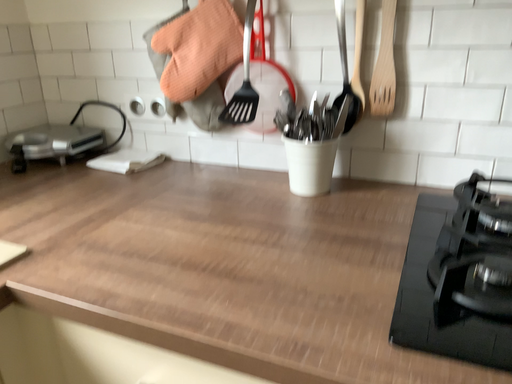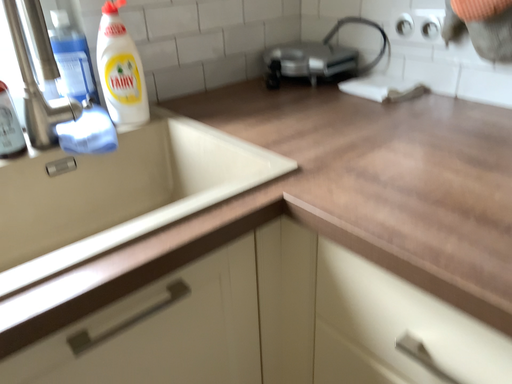
Question: How did the camera likely rotate when shooting the video?

Choices:
 (A) rotated right
 (B) rotated left

Answer: (B)